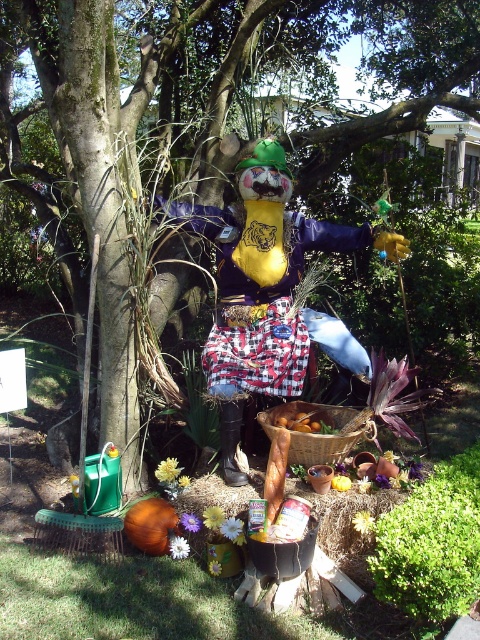
You are a visitor at a garden and see the matte yellow fabric scarecrow at center and the woven brown basket at center. Which object is taller?

The matte yellow fabric scarecrow at center is much taller than the woven brown basket at center.

You are standing at the origin point in the garden. The scarecrow needs to be moved to the center of the garden, which is at point 0.5, 0.5. Is the matte yellow fabric scarecrow at center already positioned correctly?

The matte yellow fabric scarecrow at center is located at point [272,282], which is close to but not exactly at the center point [240,320]. Therefore, it is not perfectly centered and may need adjustment.

Consider the image. You are standing 10 feet away from the camera. Can you see the matte yellow fabric scarecrow at center clearly?

The matte yellow fabric scarecrow at center is 7.95 feet away from the camera. Since you are standing 10 feet away from the camera, the distance between you and the scarecrow would be approximately 17.95 feet. At this distance, the scarecrow might appear small and less detailed, so it may not be clearly visible.